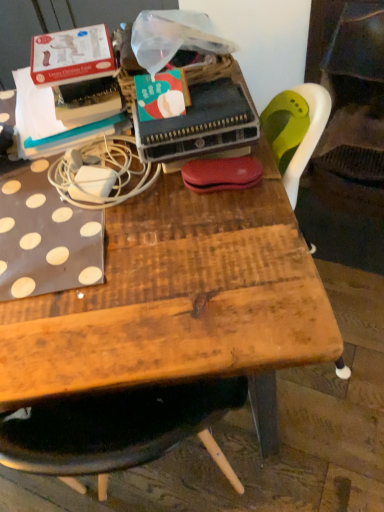
Find the location of a particular element. white matte power adapter at upper left is located at coordinates (103, 167).

Describe the element at coordinates (180, 302) in the screenshot. The image size is (384, 512). I see `wooden table at center` at that location.

Looking at this image, measure the distance between point [198,92] and camera.

The distance of point [198,92] from camera is 34.06 inches.

What do you see at coordinates (201, 123) in the screenshot? I see `matte green paperback book at center` at bounding box center [201, 123].

This screenshot has height=512, width=384. I want to click on white matte power adapter at upper left, so click(103, 167).

Which of these two, white matte power adapter at upper left or matte green paperback book at center, is thinner?

With smaller width is matte green paperback book at center.

Is white matte power adapter at upper left bigger than matte green paperback book at center?

Incorrect, white matte power adapter at upper left is not larger than matte green paperback book at center.

Looking at this image, who is more distant, white matte power adapter at upper left or matte green paperback book at center?

Positioned behind is white matte power adapter at upper left.

Is matte green paperback book at center at the back of white matte power adapter at upper left?

No, white matte power adapter at upper left's orientation is not away from matte green paperback book at center.

From the image's perspective, is wooden table at center under matte green paperback book at center?

Indeed, from the image's perspective, wooden table at center is shown beneath matte green paperback book at center.

Can you see wooden table at center touching matte green paperback book at center?

No.

Who is taller, wooden table at center or matte green paperback book at center?

matte green paperback book at center.

From the picture: Is wooden table at center spatially inside matte green paperback book at center, or outside of it?

wooden table at center lies outside matte green paperback book at center.

Could you tell me if white matte power adapter at upper left is turned towards wooden table at center?

No, white matte power adapter at upper left is not aimed at wooden table at center.

Between white matte power adapter at upper left and wooden table at center, which one has smaller size?

Smaller between the two is white matte power adapter at upper left.

Is white matte power adapter at upper left situated inside wooden table at center or outside?

white matte power adapter at upper left is not inside wooden table at center, it's outside.

Does matte green paperback book at center appear on the right side of white matte power adapter at upper left?

Yes, matte green paperback book at center is to the right of white matte power adapter at upper left.

Locate an element on the screen. The height and width of the screenshot is (512, 384). paperback book that is in front of the white matte power adapter at upper left is located at coordinates (201, 123).

Could you measure the distance between matte green paperback book at center and white matte power adapter at upper left?

A distance of 4.75 inches exists between matte green paperback book at center and white matte power adapter at upper left.

Can you confirm if matte green paperback book at center is shorter than white matte power adapter at upper left?

Incorrect, the height of matte green paperback book at center does not fall short of that of white matte power adapter at upper left.

Which object is thinner, wooden table at center or white matte power adapter at upper left?

white matte power adapter at upper left.

Does wooden table at center have a lesser height compared to white matte power adapter at upper left?

In fact, wooden table at center may be taller than white matte power adapter at upper left.

Is wooden table at center further to the viewer compared to white matte power adapter at upper left?

Yes, wooden table at center is further from the viewer.

From a real-world perspective, between matte green paperback book at center and wooden table at center, who is vertically higher?

matte green paperback book at center is physically above.

From the image's perspective, does matte green paperback book at center appear higher than wooden table at center?

Yes, from the image's perspective, matte green paperback book at center is above wooden table at center.

How different are the orientations of matte green paperback book at center and wooden table at center in degrees?

The angle between the facing direction of matte green paperback book at center and the facing direction of wooden table at center is 59.4 degrees.

Looking at the image, does matte green paperback book at center seem bigger or smaller compared to wooden table at center?

matte green paperback book at center is smaller than wooden table at center.

Locate an element on the screen. The width and height of the screenshot is (384, 512). paperback book above the white matte power adapter at upper left (from a real-world perspective) is located at coordinates (x=201, y=123).

Identify the location of table that is under the matte green paperback book at center (from a real-world perspective). click(x=180, y=302).

Looking at this image, estimate the real-world distances between objects in this image. Which object is closer to white matte power adapter at upper left, matte green paperback book at center or wooden table at center?

The object closer to white matte power adapter at upper left is matte green paperback book at center.

From the image, which object appears to be nearer to wooden table at center, matte green paperback book at center or white matte power adapter at upper left?

The object closer to wooden table at center is white matte power adapter at upper left.

When comparing their distances from matte green paperback book at center, does white matte power adapter at upper left or wooden table at center seem closer?

white matte power adapter at upper left.

Estimate the real-world distances between objects in this image. Which object is further from white matte power adapter at upper left, wooden table at center or matte green paperback book at center?

wooden table at center is positioned further to the anchor white matte power adapter at upper left.

Estimate the real-world distances between objects in this image. Which object is further from matte green paperback book at center, wooden table at center or white matte power adapter at upper left?

wooden table at center is further to matte green paperback book at center.

From the image, which object appears to be nearer to wooden table at center, white matte power adapter at upper left or matte green paperback book at center?

white matte power adapter at upper left lies closer to wooden table at center than the other object.

Locate an element on the screen. The width and height of the screenshot is (384, 512). string between matte green paperback book at center and wooden table at center in the vertical direction is located at coordinates (103, 167).